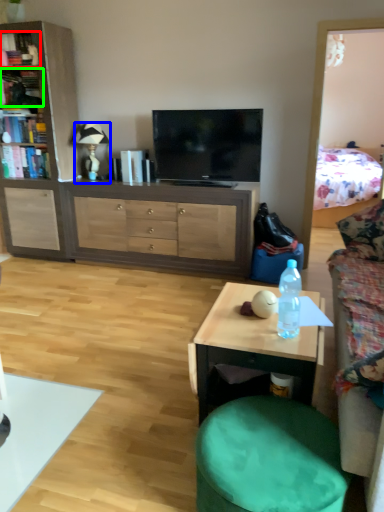
Question: Which object is positioned closest to book (highlighted by a red box)? Select from lamp (highlighted by a blue box) and book (highlighted by a green box).

Choices:
 (A) lamp
 (B) book

Answer: (B)